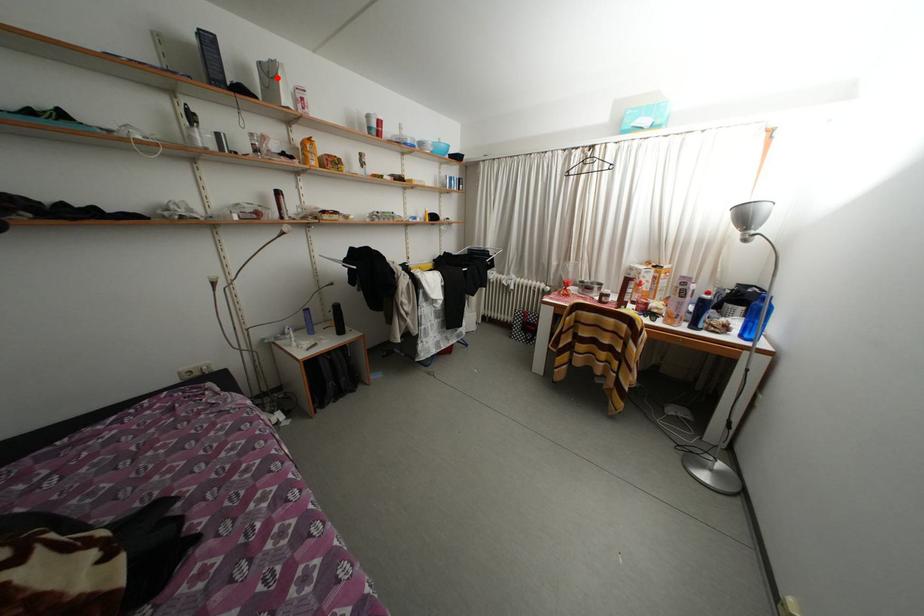
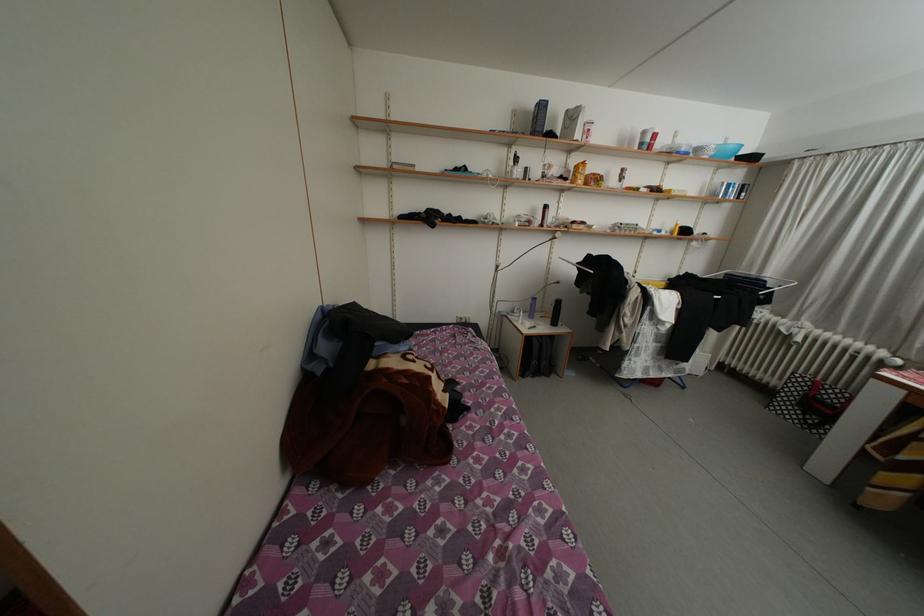
The point at the highlighted location is marked in the first image. Where is the corresponding point in the second image?

(580, 122)